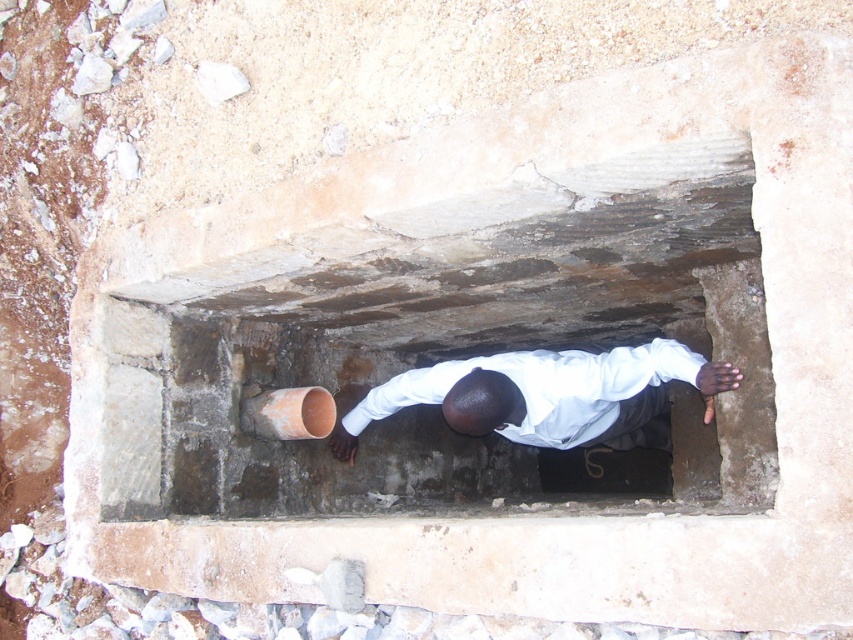
Question: Can you confirm if smooth concrete hole at center is positioned above white matte shirt at center?

Choices:
 (A) no
 (B) yes

Answer: (A)

Question: Which point is farther to the camera?

Choices:
 (A) white matte shirt at center
 (B) smooth concrete hole at center

Answer: (A)

Question: Does smooth concrete hole at center have a larger size compared to white matte shirt at center?

Choices:
 (A) yes
 (B) no

Answer: (A)

Question: Is smooth concrete hole at center closer to the viewer compared to white matte shirt at center?

Choices:
 (A) no
 (B) yes

Answer: (B)

Question: Among these objects, which one is nearest to the camera?

Choices:
 (A) smooth concrete hole at center
 (B) white matte shirt at center

Answer: (A)